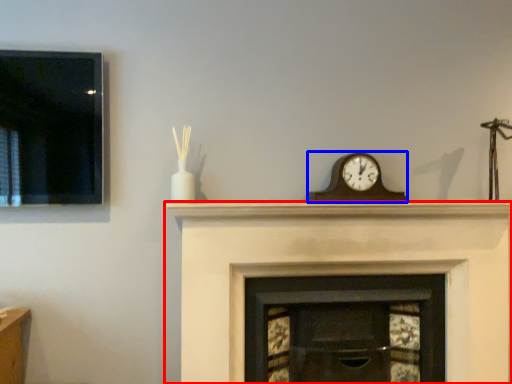
Question: Which object appears farthest to the camera in this image, fireplace (highlighted by a red box) or wall clock (highlighted by a blue box)?

Choices:
 (A) fireplace
 (B) wall clock

Answer: (B)